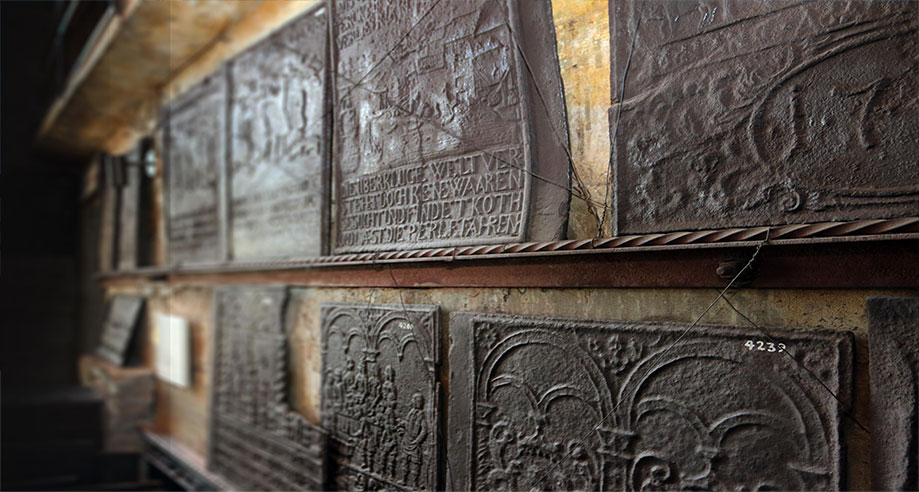
Find the location of a particular element. The width and height of the screenshot is (919, 492). broken artifact on wall is located at coordinates (286, 377), (281, 303), (303, 420).